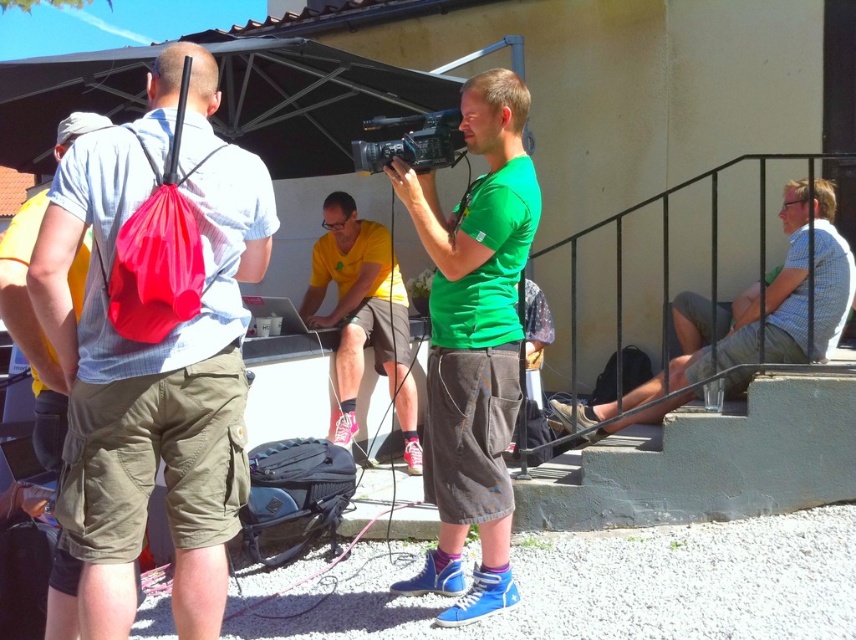
You are a photographer trying to capture a clear shot of the green matte shirt at center. There is a matte nylon backpack at left in the way. Can you adjust your position to avoid the backpack?

The matte nylon backpack at left is located above the green matte shirt at center. To avoid the backpack, you can lower your camera angle so that the backpack is out of frame while still capturing the green matte shirt at center.

What is located at the coordinate point (153, 358) in the image?

The matte nylon backpack at left is located at coordinate point (153, 358).

You are a photographer trying to capture a wide shot of the scene. The matte nylon backpack at left and the green matte shirt at center are in your frame. Which object occupies more horizontal space in the photo?

The matte nylon backpack at left is wider than the green matte shirt at center, so it occupies more horizontal space in the photo.